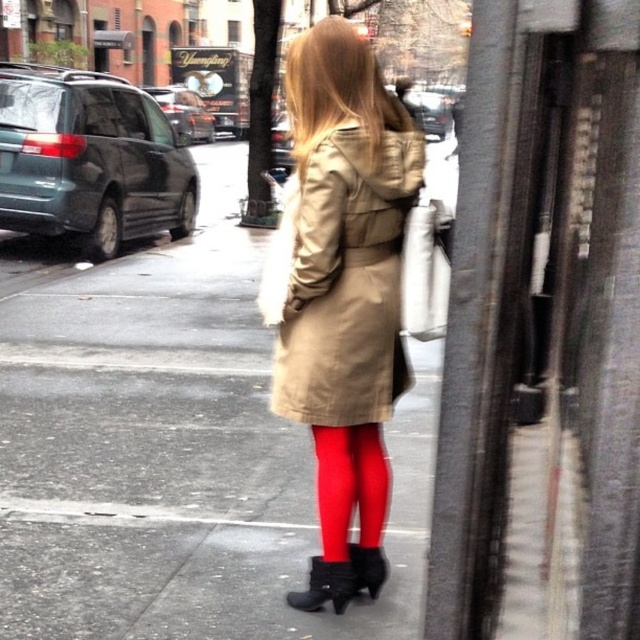
Can you confirm if matte beige trench coat at center is smaller than tan fabric coat at center?

No, matte beige trench coat at center is not smaller than tan fabric coat at center.

Does matte beige trench coat at center appear on the left side of tan fabric coat at center?

Yes, matte beige trench coat at center is to the left of tan fabric coat at center.

Is point (42, 554) positioned in front of point (278, 307)?

That is False.

You are a GUI agent. You are given a task and a screenshot of the screen. Output one action in this format:
    pyautogui.click(x=<x>, y=<y>)
    Task: Click on the matte beige trench coat at center
    This screenshot has height=640, width=640.
    Given the screenshot: What is the action you would take?
    pyautogui.click(x=173, y=449)

Describe the element at coordinates (324, 586) in the screenshot. I see `shiny black boot at center` at that location.

Does point (312, 595) lie behind point (353, 566)?

No, (312, 595) is in front of (353, 566).

Which is behind, point (355, 580) or point (385, 579)?

Positioned behind is point (385, 579).

Find the location of a particular element. shiny black boot at center is located at coordinates (324, 586).

Based on the photo, who is higher up, tan fabric coat at center or shiny black boot at center?

tan fabric coat at center

Looking at this image, which is more to the left, tan fabric coat at center or shiny black boot at center?

Positioned to the left is shiny black boot at center.

Does point (353, 368) lie in front of point (321, 605)?

Yes.

At what (x,y) coordinates should I click in order to perform the action: click on tan fabric coat at center. Please return your answer as a coordinate pair (x, y). The width and height of the screenshot is (640, 640). Looking at the image, I should click on (340, 280).